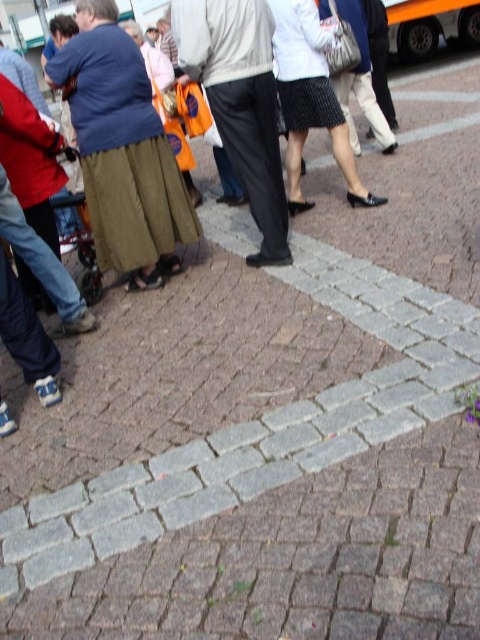
Question: Among these points, which one is farthest from the camera?

Choices:
 (A) click(x=307, y=131)
 (B) click(x=129, y=112)
 (C) click(x=272, y=125)

Answer: (A)

Question: From the image, what is the correct spatial relationship of matte olive skirt at left in relation to black textured skirt at center?

Choices:
 (A) below
 (B) above

Answer: (A)

Question: Which object is closer to the camera taking this photo?

Choices:
 (A) black textured skirt at center
 (B) matte olive skirt at left
 (C) dark gray pants at center

Answer: (B)

Question: Is dark gray pants at center further to the viewer compared to black textured skirt at center?

Choices:
 (A) yes
 (B) no

Answer: (B)

Question: Is matte olive skirt at left bigger than dark gray pants at center?

Choices:
 (A) no
 (B) yes

Answer: (B)

Question: Which point is farther from the camera taking this photo?

Choices:
 (A) (295, 36)
 (B) (262, 211)

Answer: (A)